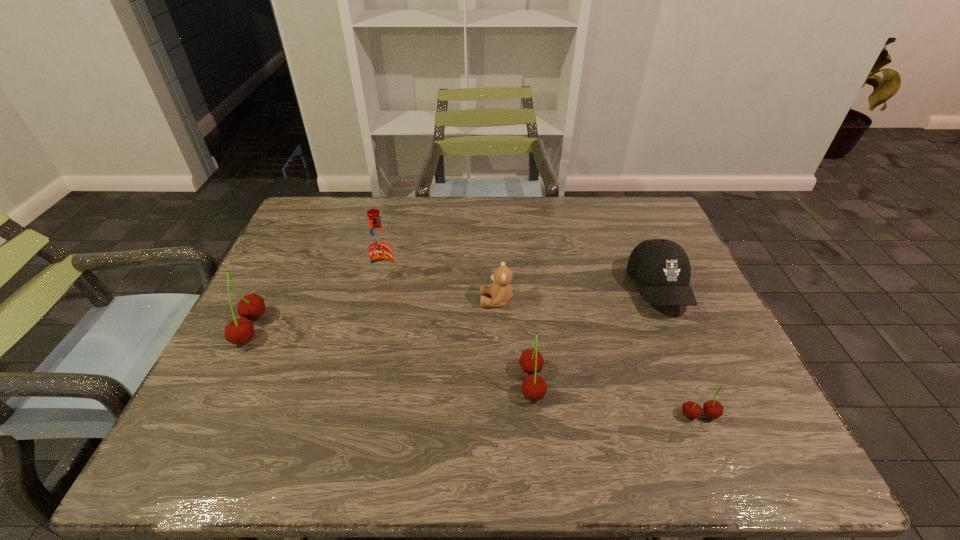
Locate an element on the screen. The height and width of the screenshot is (540, 960). vacant space at the far edge is located at coordinates (424, 208).

Identify the location of vacant space at the near edge of the desktop. This screenshot has width=960, height=540. (632, 393).

Where is `free spot at the left edge of the desktop`? free spot at the left edge of the desktop is located at coordinates (261, 372).

You are a GUI agent. You are given a task and a screenshot of the screen. Output one action in this format:
    pyautogui.click(x=<x>, y=<y>)
    Task: Click on the vacant space at the right edge of the desktop
    The height and width of the screenshot is (540, 960).
    Given the screenshot: What is the action you would take?
    pyautogui.click(x=669, y=361)

You are a GUI agent. You are given a task and a screenshot of the screen. Output one action in this format:
    pyautogui.click(x=<x>, y=<y>)
    Task: Click on the vacant area at the far left corner of the desktop
    
    Given the screenshot: What is the action you would take?
    318,235

Where is `free space at the near left corner of the desktop`? This screenshot has height=540, width=960. free space at the near left corner of the desktop is located at coordinates (263, 407).

At what (x,y) coordinates should I click in order to perform the action: click on free point at the far right corner. Please return your answer as a coordinate pair (x, y). This screenshot has width=960, height=540. Looking at the image, I should click on (660, 233).

Locate an element on the screen. The height and width of the screenshot is (540, 960). vacant point at the near right corner is located at coordinates (737, 384).

This screenshot has width=960, height=540. I want to click on free spot between the third object from left to right and the farthest cherry, so click(x=373, y=315).

You are a GUI agent. You are given a task and a screenshot of the screen. Output one action in this format:
    pyautogui.click(x=<x>, y=<y>)
    Task: Click on the empty space that is in between the baseball cap and the rightmost cherry
    The width and height of the screenshot is (960, 540).
    Given the screenshot: What is the action you would take?
    (x=679, y=352)